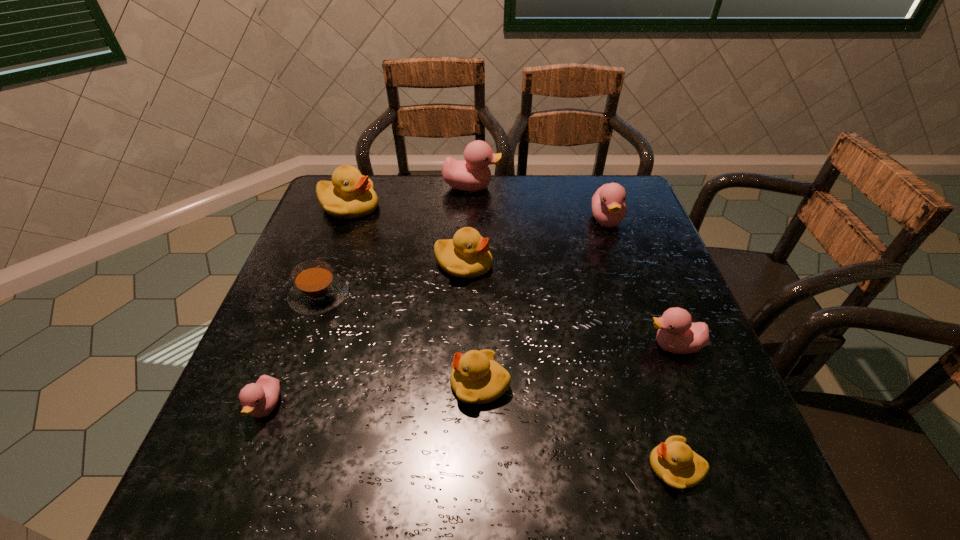
The height and width of the screenshot is (540, 960). In order to click on cappuccino present at the left edge in this screenshot , I will do `click(316, 290)`.

Image resolution: width=960 pixels, height=540 pixels. What are the coordinates of `object that is positioned at the far left corner` in the screenshot? It's located at (350, 195).

This screenshot has height=540, width=960. I want to click on object that is at the far right corner, so click(609, 208).

You are a GUI agent. You are given a task and a screenshot of the screen. Output one action in this format:
    pyautogui.click(x=<x>, y=<y>)
    Task: Click on the object that is at the near right corner
    
    Given the screenshot: What is the action you would take?
    pyautogui.click(x=674, y=462)

The width and height of the screenshot is (960, 540). Identify the location of vacant space at the far edge of the desktop. (475, 201).

In the image, there is a desktop. At what (x,y) coordinates should I click in order to perform the action: click on vacant space at the near edge. Please return your answer as a coordinate pair (x, y). This screenshot has height=540, width=960. Looking at the image, I should click on (492, 497).

Where is `free space at the left edge of the desktop`? The image size is (960, 540). free space at the left edge of the desktop is located at coordinates (329, 256).

Where is `vacant region at the right edge`? The width and height of the screenshot is (960, 540). vacant region at the right edge is located at coordinates point(647,273).

The image size is (960, 540). In the image, there is a desktop. Find the location of `vacant space at the near left corner`. vacant space at the near left corner is located at coordinates (225, 463).

You are a GUI agent. You are given a task and a screenshot of the screen. Output one action in this format:
    pyautogui.click(x=<x>, y=<y>)
    Task: Click on the free space between the third nearest pink duckling and the farthest pink duckling
    The image size is (960, 540).
    Given the screenshot: What is the action you would take?
    pyautogui.click(x=539, y=204)